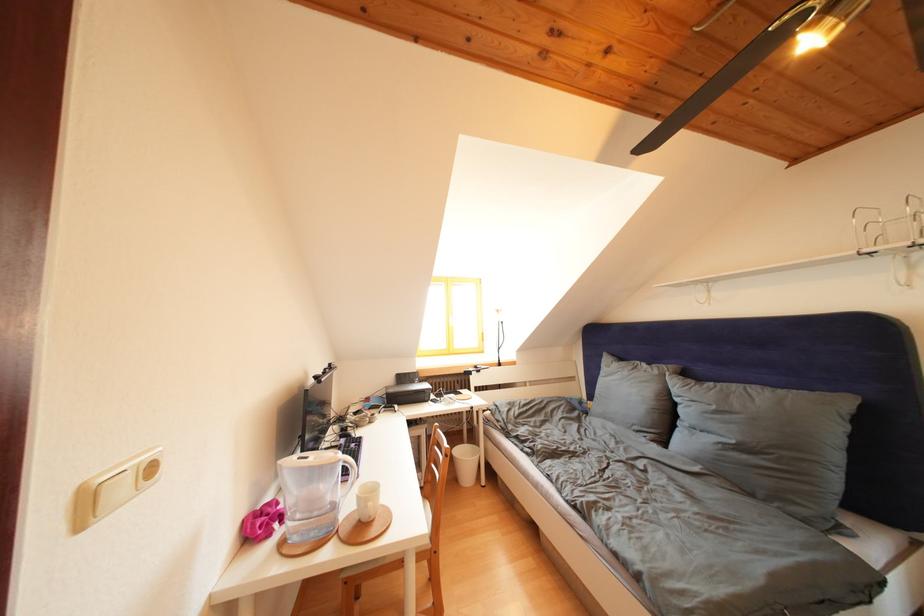
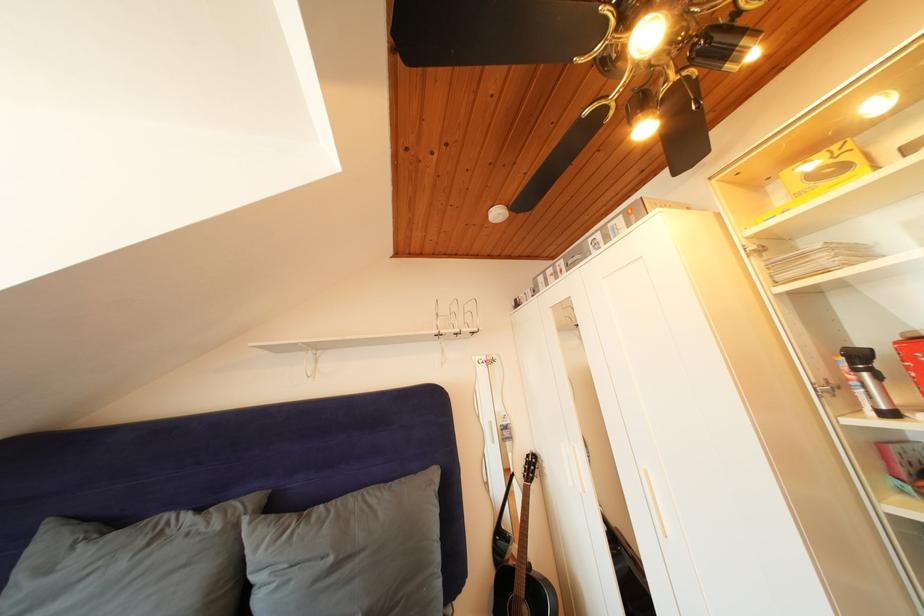
Find the pixel in the second image that matches the point at 722,411 in the first image.

(338, 565)